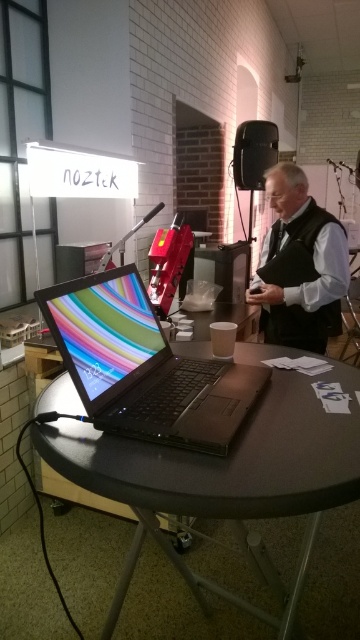
You are organizing a workshop and need to place a name tag on the dark gray vest at center. Where should you place it relative to the black plastic table at center?

The dark gray vest at center is to the right of the black plastic table at center, so you should place the name tag on the right side of the dark gray vest at center relative to the table.

Looking at this image, you are standing in front of the shiny black laptop at center. If you want to reach the red machine to your left, which is 4 feet away from the laptop, can you do so without moving the laptop?

The shiny black laptop at center is 33.50 inches from viewer. Since the red machine is 4 feet away from the laptop, you can reach it without moving the laptop because 4 feet is approximately 48 inches, which is farther than the distance to the laptop itself.

What object is located at the coordinates point (144, 365)?

The shiny black laptop at center is located at point (144, 365).